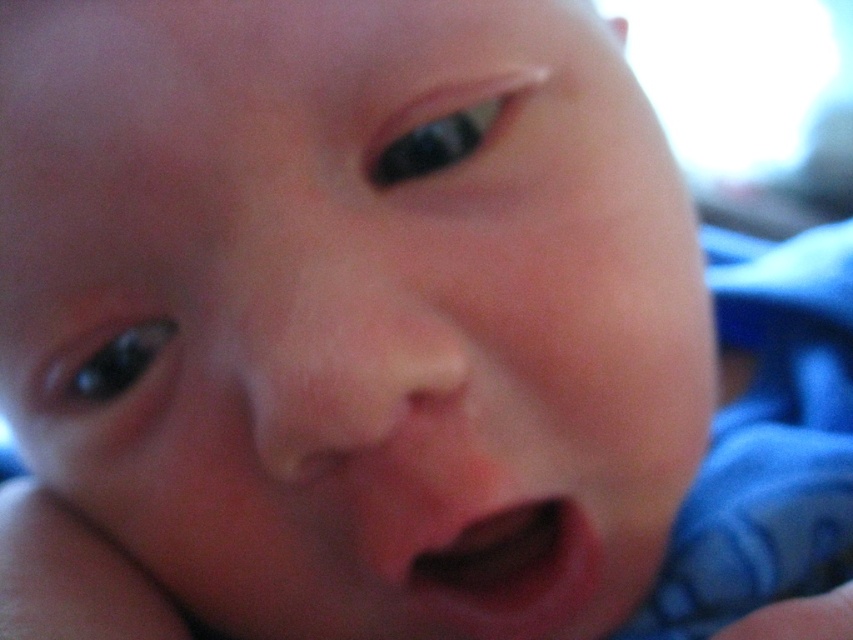
Question: Can you confirm if pink smooth flesh at center is positioned to the left of smooth skin hand at lower right?

Choices:
 (A) yes
 (B) no

Answer: (A)

Question: Can you confirm if pink smooth flesh at center is positioned to the left of smooth skin hand at lower right?

Choices:
 (A) no
 (B) yes

Answer: (B)

Question: Does pink smooth flesh at center appear over smooth skin hand at lower right?

Choices:
 (A) yes
 (B) no

Answer: (A)

Question: Which object is farther from the camera taking this photo?

Choices:
 (A) pink smooth flesh at center
 (B) smooth skin hand at lower right

Answer: (A)